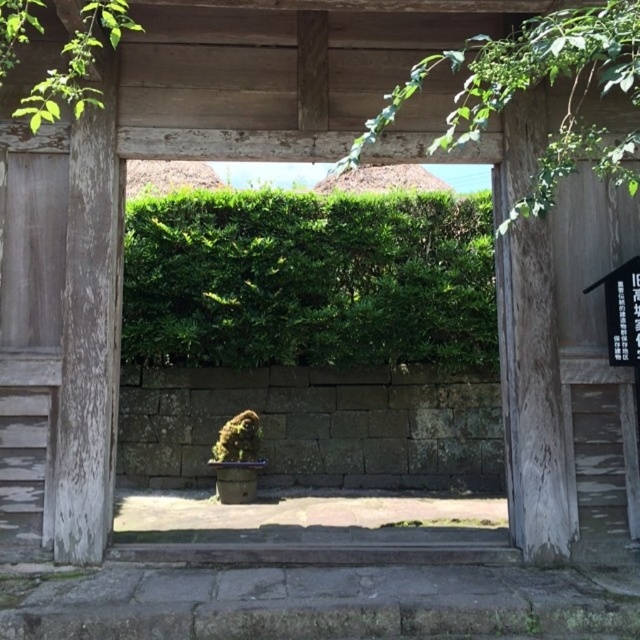
Question: Which of the following is the farthest from the observer?

Choices:
 (A) (387, 332)
 (B) (320, 205)

Answer: (B)

Question: Which point is farther to the camera?

Choices:
 (A) green leafy hedge at center
 (B) green leafy hedge at upper center

Answer: (A)

Question: Is green leafy hedge at center smaller than green leafy hedge at upper center?

Choices:
 (A) yes
 (B) no

Answer: (B)

Question: Is green leafy hedge at center bigger than green leafy hedge at upper center?

Choices:
 (A) no
 (B) yes

Answer: (B)

Question: Is green leafy hedge at center above green leafy hedge at upper center?

Choices:
 (A) no
 (B) yes

Answer: (A)

Question: Which object is farther from the camera taking this photo?

Choices:
 (A) green leafy hedge at center
 (B) green leafy hedge at upper center

Answer: (A)